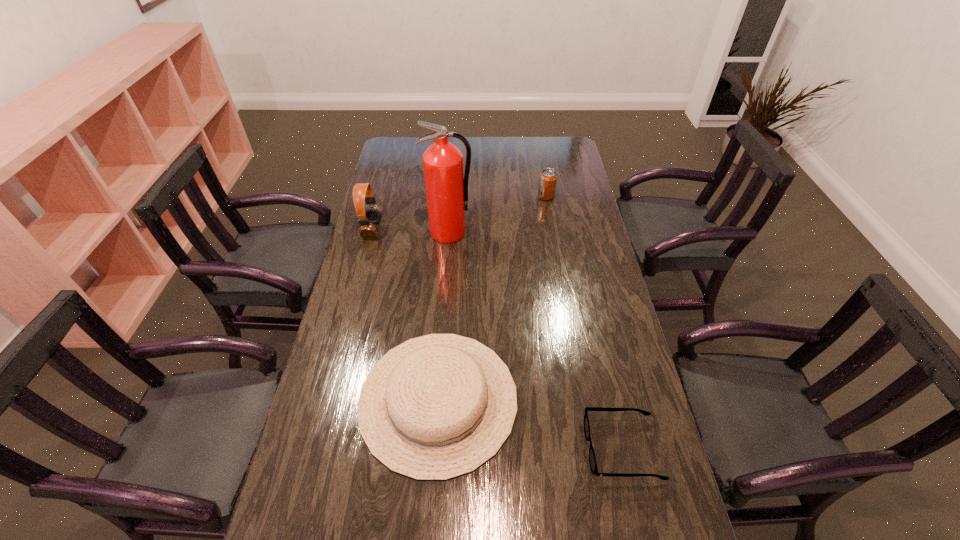
Where is `vacant space positioned on the back of the sunhat`? This screenshot has height=540, width=960. vacant space positioned on the back of the sunhat is located at coordinates (446, 287).

I want to click on free space located on the arms of the shortest object, so click(485, 449).

Image resolution: width=960 pixels, height=540 pixels. I want to click on vacant space situated 0.170m on the arms of the shortest object, so click(517, 449).

This screenshot has height=540, width=960. What are the coordinates of `free spot located on the arms of the shortest object` in the screenshot? It's located at (510, 449).

The height and width of the screenshot is (540, 960). I want to click on headset that is at the left edge, so click(x=371, y=215).

In order to click on sunhat at the left edge in this screenshot , I will do `click(435, 407)`.

The width and height of the screenshot is (960, 540). What are the coordinates of `soda can that is at the right edge` in the screenshot? It's located at (548, 178).

The image size is (960, 540). Identify the location of spectacles that is at the right edge. (592, 459).

Locate an element on the screen. Image resolution: width=960 pixels, height=540 pixels. vacant space at the far edge is located at coordinates (473, 143).

Find the location of a particular element. vacant position at the left edge of the desktop is located at coordinates (357, 261).